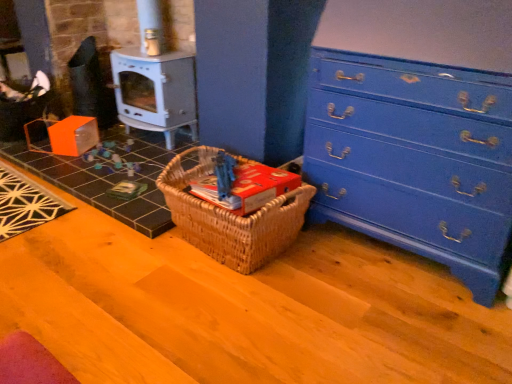
Question: Is orange cardboard box at lower left surrounding metallic gray stove at center left?

Choices:
 (A) yes
 (B) no

Answer: (B)

Question: Considering the relative positions of orange cardboard box at lower left and metallic gray stove at center left in the image provided, is orange cardboard box at lower left to the right of metallic gray stove at center left from the viewer's perspective?

Choices:
 (A) yes
 (B) no

Answer: (B)

Question: Is orange cardboard box at lower left oriented towards metallic gray stove at center left?

Choices:
 (A) yes
 (B) no

Answer: (B)

Question: Is orange cardboard box at lower left thinner than metallic gray stove at center left?

Choices:
 (A) no
 (B) yes

Answer: (A)

Question: Considering the relative positions of orange cardboard box at lower left and metallic gray stove at center left in the image provided, is orange cardboard box at lower left in front of metallic gray stove at center left?

Choices:
 (A) yes
 (B) no

Answer: (A)

Question: Considering the positions of orange cardboard box at lower left and metallic gray stove at center left in the image, is orange cardboard box at lower left bigger or smaller than metallic gray stove at center left?

Choices:
 (A) big
 (B) small

Answer: (B)

Question: Considering the positions of point (104, 203) and point (150, 114), is point (104, 203) closer or farther from the camera than point (150, 114)?

Choices:
 (A) farther
 (B) closer

Answer: (B)

Question: Is orange cardboard box at lower left wider or thinner than metallic gray stove at center left?

Choices:
 (A) wide
 (B) thin

Answer: (A)

Question: From the image's perspective, is orange cardboard box at lower left above or below metallic gray stove at center left?

Choices:
 (A) below
 (B) above

Answer: (A)

Question: Is woven wood picnic basket at center wider or thinner than metallic gray stove at center left?

Choices:
 (A) thin
 (B) wide

Answer: (B)

Question: From a real-world perspective, is woven wood picnic basket at center physically located above or below metallic gray stove at center left?

Choices:
 (A) below
 (B) above

Answer: (A)

Question: Considering the positions of woven wood picnic basket at center and metallic gray stove at center left in the image, is woven wood picnic basket at center bigger or smaller than metallic gray stove at center left?

Choices:
 (A) small
 (B) big

Answer: (A)

Question: Is point (249, 225) closer or farther from the camera than point (135, 72)?

Choices:
 (A) closer
 (B) farther

Answer: (A)

Question: Would you say blue painted wood chest of drawers at right is to the left or to the right of orange cardboard box at lower left in the picture?

Choices:
 (A) left
 (B) right

Answer: (B)

Question: From the image's perspective, is blue painted wood chest of drawers at right located above or below orange cardboard box at lower left?

Choices:
 (A) below
 (B) above

Answer: (B)